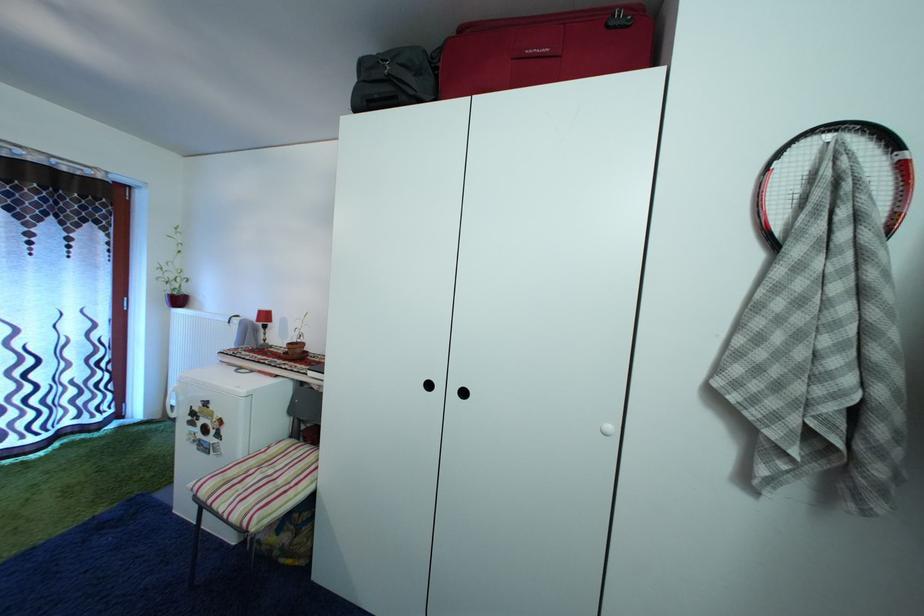
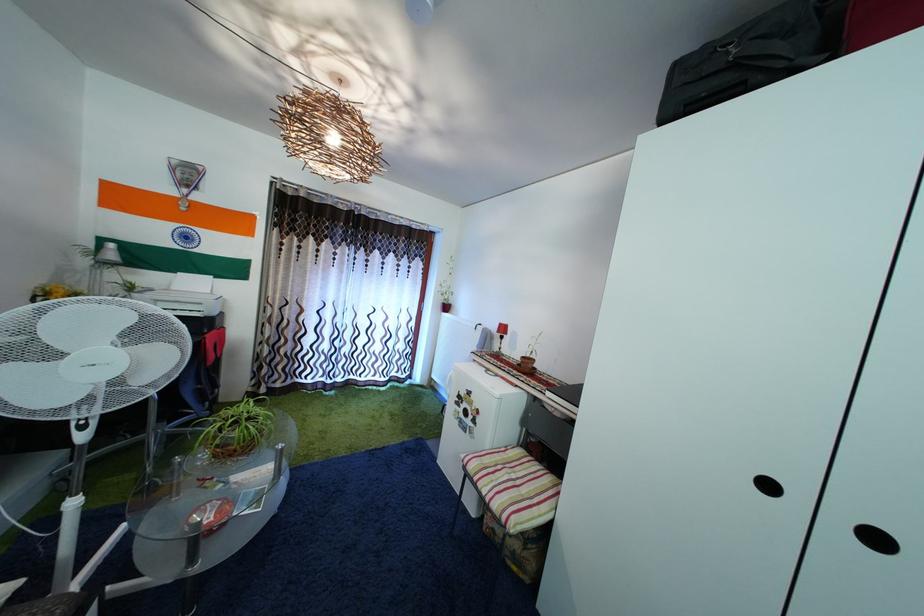
Question: The camera is either moving clockwise (left) or counter-clockwise (right) around the object. The first image is from the beginning of the video and the second image is from the end. Is the camera moving left or right when shooting the video?

Choices:
 (A) Left
 (B) Right

Answer: (B)